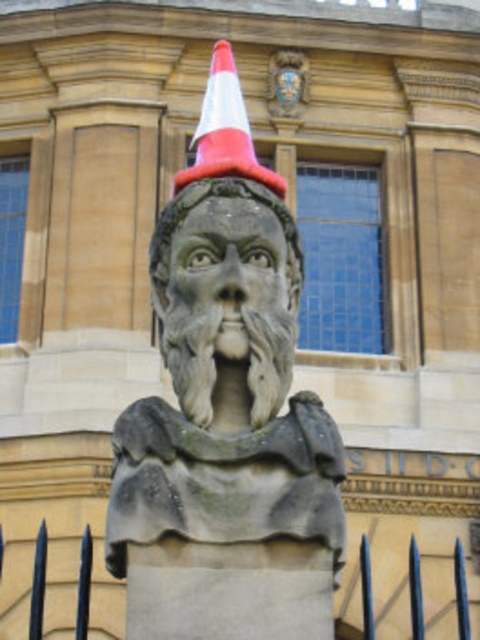
Between stone statue at center and white and orange cone at center, which one has more height?

Standing taller between the two is white and orange cone at center.

Who is positioned more to the right, stone statue at center or white and orange cone at center?

white and orange cone at center is more to the right.

Describe the element at coordinates (227, 413) in the screenshot. I see `stone statue at center` at that location.

Locate an element on the screen. The width and height of the screenshot is (480, 640). stone statue at center is located at coordinates (227, 413).

Is gray stone face at center positioned behind black metal spikes at lower center?

Yes, it is behind black metal spikes at lower center.

Who is more forward, [165,289] or [372,604]?

Point [372,604] is more forward.

You are a GUI agent. You are given a task and a screenshot of the screen. Output one action in this format:
    pyautogui.click(x=<x>, y=<y>)
    Task: Click on the gray stone face at center
    
    Given the screenshot: What is the action you would take?
    pyautogui.click(x=225, y=268)

Is stone statue at center smaller than gray stone face at center?

Actually, stone statue at center might be larger than gray stone face at center.

Is point (156, 256) closer to camera compared to point (240, 227)?

No.

What are the coordinates of `stone statue at center` in the screenshot? It's located at (227, 413).

This screenshot has height=640, width=480. I want to click on stone statue at center, so click(x=227, y=413).